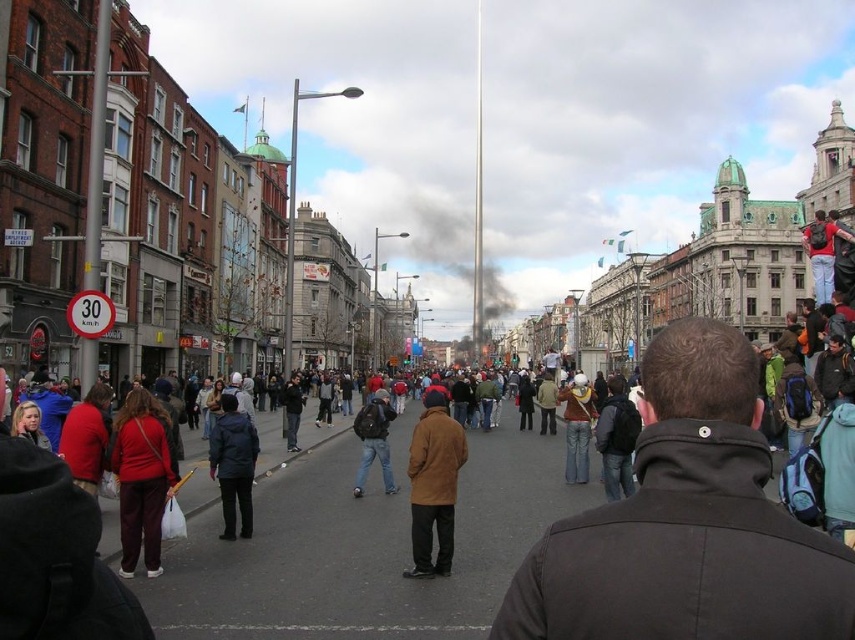
You are a photographer standing at the edge of the crowd in the urban street scene. You want to take a photo of the matte black backpack at center. Where should you aim your camera to capture the backpack in the frame?

You should aim your camera at the point with coordinates 0.689 on the x axis and 0.439 on the y axis to capture the matte black backpack at center.